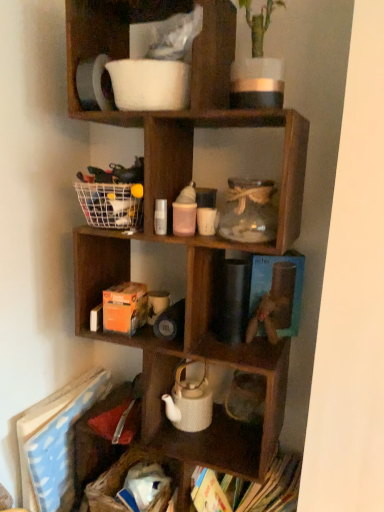
Question: From their relative heights in the image, would you say white textured teapot at center is taller or shorter than blue paper book at lower left, which is counted as the 1th book, starting from the left?

Choices:
 (A) tall
 (B) short

Answer: (B)

Question: Is white textured teapot at center situated inside blue paper book at lower left, which is the second book from right to left, or outside?

Choices:
 (A) inside
 (B) outside

Answer: (B)

Question: Estimate the real-world distances between objects in this image. Which object is farther from the blue paper book at lower left, which is counted as the 1th book, starting from the left?

Choices:
 (A) wooden toy at center
 (B) white textured teapot at center
 (C) hardcover book at bottom right, which is the 1th book in right-to-left order
 (D) white woven basket at lower left
 (E) white matte pitcher at upper center, placed as the first shelf when sorted from top to bottom

Answer: (E)

Question: Which of these objects is positioned closest to the white matte pitcher at upper center, placed as the first shelf when sorted from top to bottom?

Choices:
 (A) wooden cube at center, placed as the first shelf when sorted from bottom to top
 (B) white woven basket at lower left
 (C) white textured teapot at center
 (D) wooden toy at center
 (E) hardcover book at bottom right, which appears as the second book when viewed from the left

Answer: (A)